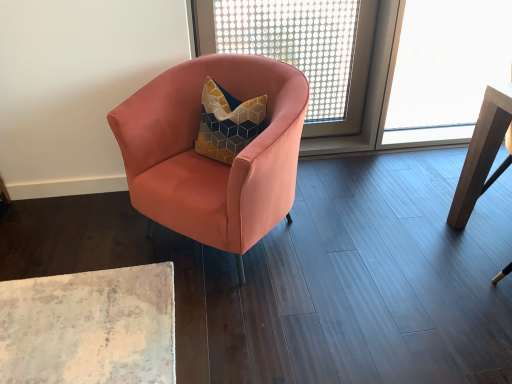
Question: From a real-world perspective, is transparent plastic screen at upper center positioned above or below wooden table at right?

Choices:
 (A) above
 (B) below

Answer: (A)

Question: In terms of height, does transparent plastic screen at upper center look taller or shorter compared to wooden table at right?

Choices:
 (A) tall
 (B) short

Answer: (A)

Question: Which object is positioned farthest from the matte pink armchair at center?

Choices:
 (A) transparent plastic screen at upper center
 (B) wooden table at right

Answer: (A)

Question: Which object is positioned closest to the wooden table at right?

Choices:
 (A) matte pink armchair at center
 (B) transparent plastic screen at upper center

Answer: (A)